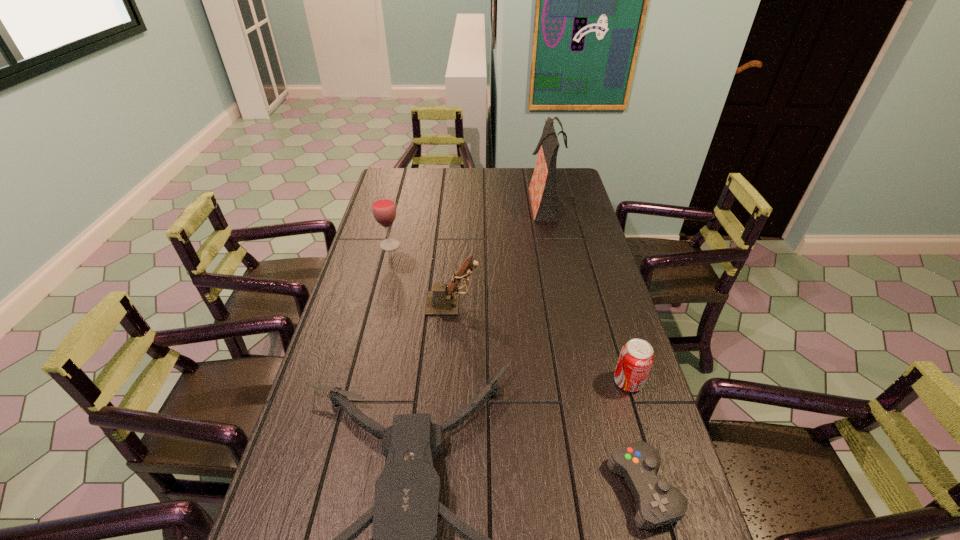
Where is `the farthest object`? the farthest object is located at coordinates (542, 189).

This screenshot has height=540, width=960. Find the location of `shopping bag`. shopping bag is located at coordinates (542, 189).

Find the location of a particular element. figurine is located at coordinates (444, 299).

Locate an element on the screen. Image resolution: width=960 pixels, height=540 pixels. wineglass is located at coordinates (384, 209).

Locate an element on the screen. The width and height of the screenshot is (960, 540). the fourth tallest object is located at coordinates (636, 358).

This screenshot has height=540, width=960. Identify the location of control. (658, 503).

The image size is (960, 540). What are the coordinates of `vacant space located 0.090m on the front side of the shopping bag` in the screenshot? It's located at (507, 202).

This screenshot has height=540, width=960. I want to click on blank area located on the front side of the shopping bag, so click(x=444, y=202).

This screenshot has width=960, height=540. Find the location of `free region located 0.390m on the front side of the shopping bag`. free region located 0.390m on the front side of the shopping bag is located at coordinates (439, 202).

You are a GUI agent. You are given a task and a screenshot of the screen. Output one action in this format:
    pyautogui.click(x=<x>, y=<y>)
    Task: Click on the blank area located on the front-facing side of the figurine
    
    Given the screenshot: What is the action you would take?
    pyautogui.click(x=530, y=303)